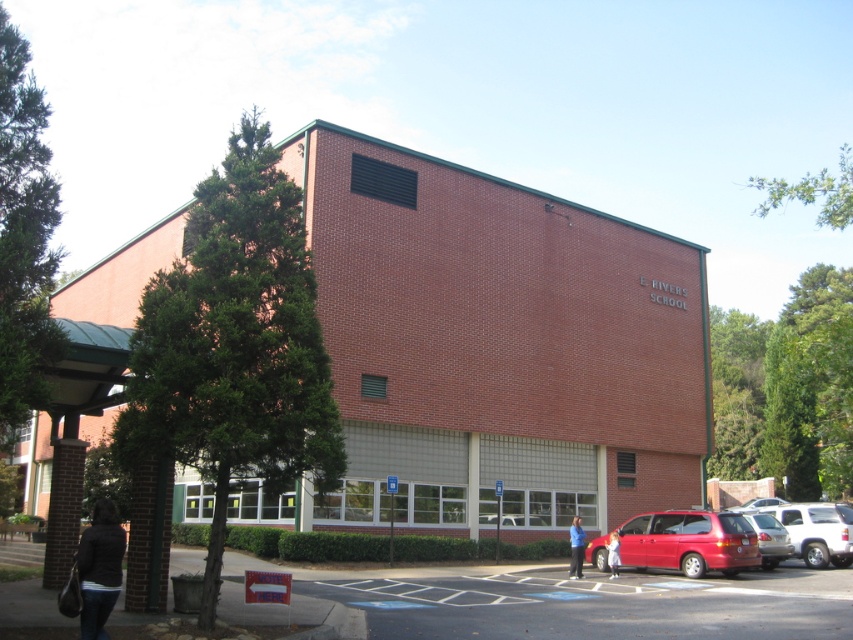
Is silver metallic suv at center right thinner than matte red van at center?

Incorrect, silver metallic suv at center right's width is not less than matte red van at center's.

Is point (801, 547) less distant than point (791, 544)?

No, it is behind (791, 544).

The height and width of the screenshot is (640, 853). Find the location of `silver metallic suv at center right`. silver metallic suv at center right is located at coordinates coord(817,531).

Is dark gray jacket at lower left shorter than matte red van at center?

Correct, dark gray jacket at lower left is not as tall as matte red van at center.

Is point (100, 580) closer to viewer compared to point (779, 525)?

That is True.

This screenshot has width=853, height=640. In order to click on dark gray jacket at lower left in this screenshot , I will do `click(99, 568)`.

Looking at this image, which is above, metallic red minivan at center or dark gray jacket at lower left?

dark gray jacket at lower left is above.

This screenshot has width=853, height=640. Describe the element at coordinates (689, 541) in the screenshot. I see `metallic red minivan at center` at that location.

Locate an element on the screen. The width and height of the screenshot is (853, 640). metallic red minivan at center is located at coordinates (689, 541).